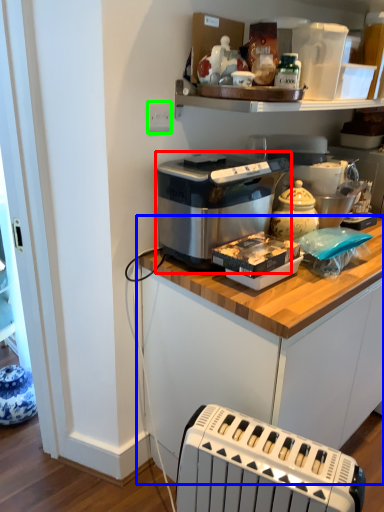
Question: Based on their relative distances, which object is farther from home appliance (highlighted by a red box)? Choose from cabinetry (highlighted by a blue box) and electric outlet (highlighted by a green box).

Choices:
 (A) cabinetry
 (B) electric outlet

Answer: (B)